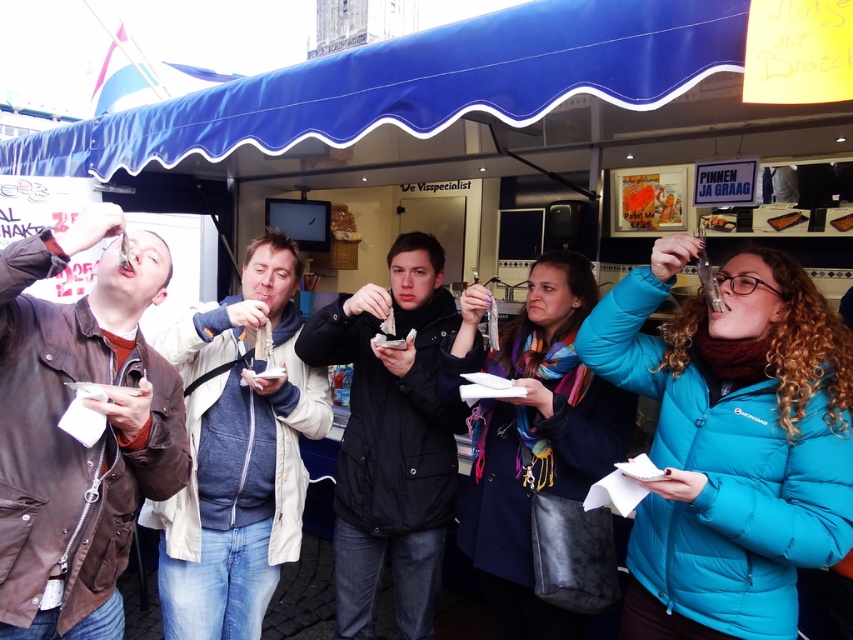
Question: Observing the image, what is the correct spatial positioning of blue fabric canopy at upper center in reference to brown leather jacket at left?

Choices:
 (A) right
 (B) left

Answer: (B)

Question: Is black matte jacket at center closer to camera compared to brown wooden stick at upper center?

Choices:
 (A) no
 (B) yes

Answer: (B)

Question: Among these points, which one is nearest to the camera?

Choices:
 (A) (712, 220)
 (B) (613, 365)
 (C) (416, 467)

Answer: (B)

Question: Which point is farther to the camera?

Choices:
 (A) blue quilted jacket at center
 (B) light beige jacket at center
 (C) black matte jacket at center
 (D) teal puffer jacket at right

Answer: (C)

Question: Which is farther from the matte plastic spoon at upper center?

Choices:
 (A) brown wooden stick at upper center
 (B) brown leather jacket at left
 (C) black matte jacket at center

Answer: (B)

Question: Can you confirm if light beige jacket at center is bigger than matte plastic spoon at upper center?

Choices:
 (A) no
 (B) yes

Answer: (B)